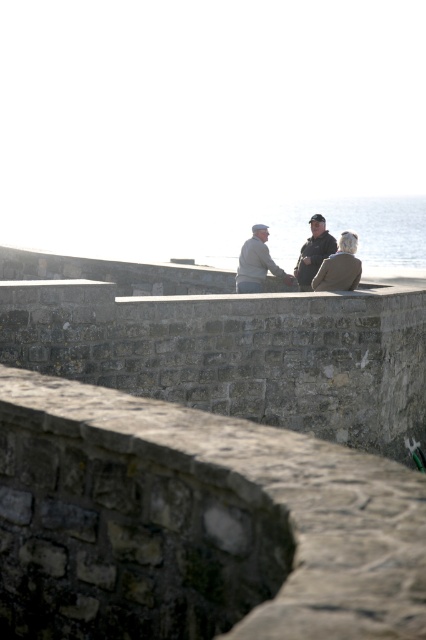
You are a photographer trying to capture a photo of the dark gray knit hat at center and the light gray sweater at center. Since you want both items to appear the same size in the photo, which object should you move closer to the camera?

The dark gray knit hat at center is bigger than the light gray sweater at center. To make them appear the same size in the photo, you should move the light gray sweater at center closer to the camera.

You are standing on the stone wall and want to hand a map to the person wearing the dark gray knit hat at center. Which direction should you approach from relative to the light gray sweater at center?

You should approach from in front of the light gray sweater at center because the dark gray knit hat at center is positioned in front of the light gray sweater at center, meaning the light gray sweater at center is behind the hat.

You are standing on the stone wall and want to wave to the person wearing the dark gray knit hat at center. Which direction should you face relative to the light gray sweater at center?

You should face to the right of the light gray sweater at center because the dark gray knit hat at center is positioned to the right of it.